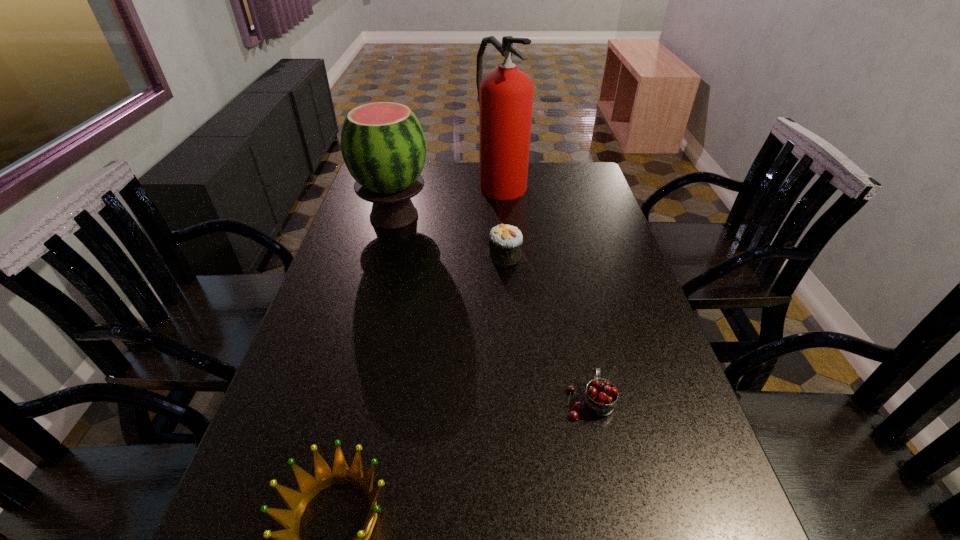
Find the location of `vacant point located between the cupcake and the tallest object`. vacant point located between the cupcake and the tallest object is located at coordinates (503, 219).

Find the location of a particular element. The height and width of the screenshot is (540, 960). blank region between the cherry and the fourth shortest object is located at coordinates (492, 308).

Identify the location of vacant area that lies between the rightmost object and the cupcake. (547, 328).

Locate an element on the screen. The height and width of the screenshot is (540, 960). vacant point located between the second tallest object and the rightmost object is located at coordinates (492, 308).

Locate an element on the screen. The width and height of the screenshot is (960, 540). empty space that is in between the fire extinguisher and the cupcake is located at coordinates (503, 219).

You are a GUI agent. You are given a task and a screenshot of the screen. Output one action in this format:
    pyautogui.click(x=<x>, y=<y>)
    Task: Click on the vacant region between the fourth farthest object and the third nearest object
    This screenshot has height=540, width=960.
    Given the screenshot: What is the action you would take?
    pyautogui.click(x=547, y=328)

At what (x,y) coordinates should I click in order to perform the action: click on the fourth closest object to the watermelon. Please return your answer as a coordinate pair (x, y). Looking at the image, I should click on (296, 501).

This screenshot has width=960, height=540. I want to click on the closest object to the cherry, so click(296, 501).